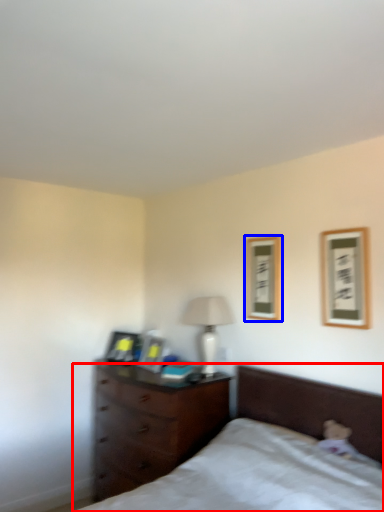
Question: Which object appears farthest to the camera in this image, bed (highlighted by a red box) or picture frame (highlighted by a blue box)?

Choices:
 (A) bed
 (B) picture frame

Answer: (B)